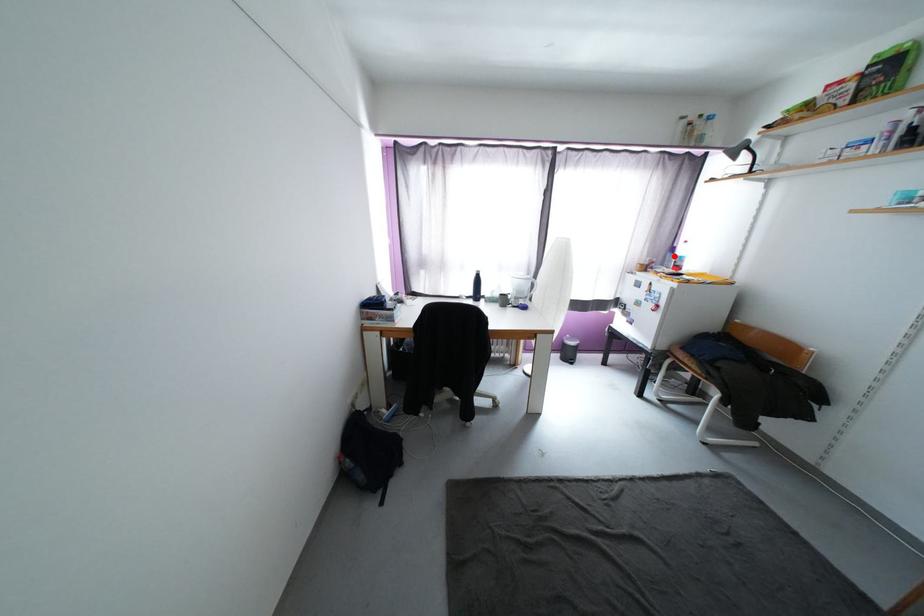
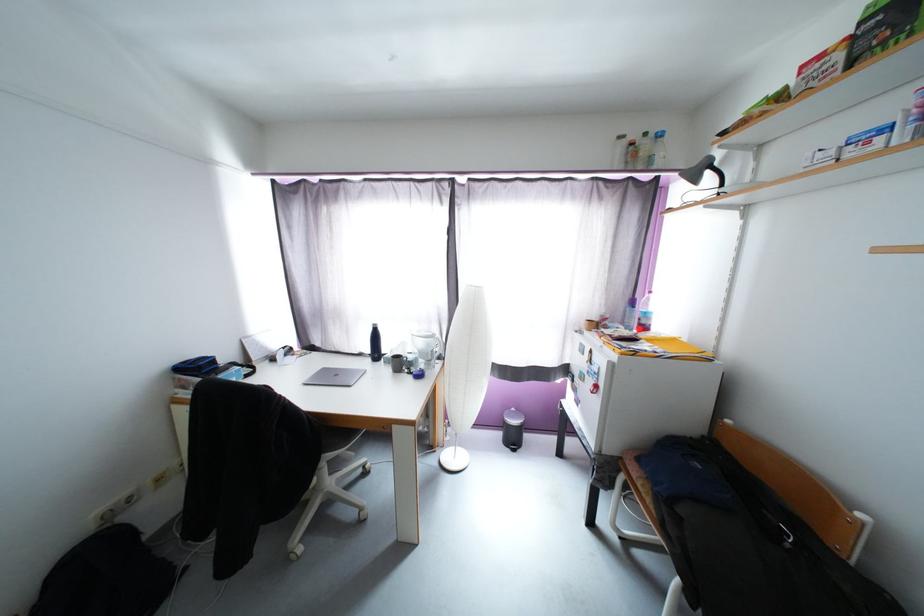
The point at the highlighted location is marked in the first image. Where is the corresponding point in the second image?

(634, 310)